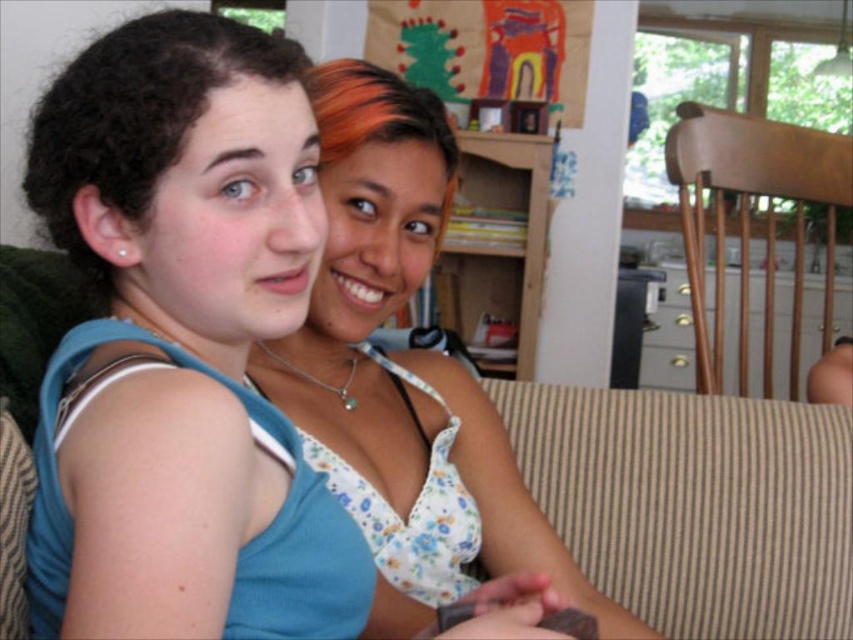
Question: Which point is closer to the camera?

Choices:
 (A) blue fabric tank top at center
 (B) floral fabric top at center

Answer: (A)

Question: Which point is farther from the camera taking this photo?

Choices:
 (A) (77, 550)
 (B) (815, 432)
 (C) (547, 573)

Answer: (B)

Question: Which point is closer to the camera?

Choices:
 (A) floral fabric top at center
 (B) brown striped fabric at lower right

Answer: (A)

Question: Where is blue fabric tank top at center located in relation to brown striped fabric at lower right in the image?

Choices:
 (A) below
 (B) above

Answer: (B)

Question: Does blue fabric tank top at center appear on the left side of brown striped fabric at lower right?

Choices:
 (A) yes
 (B) no

Answer: (A)

Question: Is the position of blue fabric tank top at center more distant than that of floral fabric top at center?

Choices:
 (A) no
 (B) yes

Answer: (A)